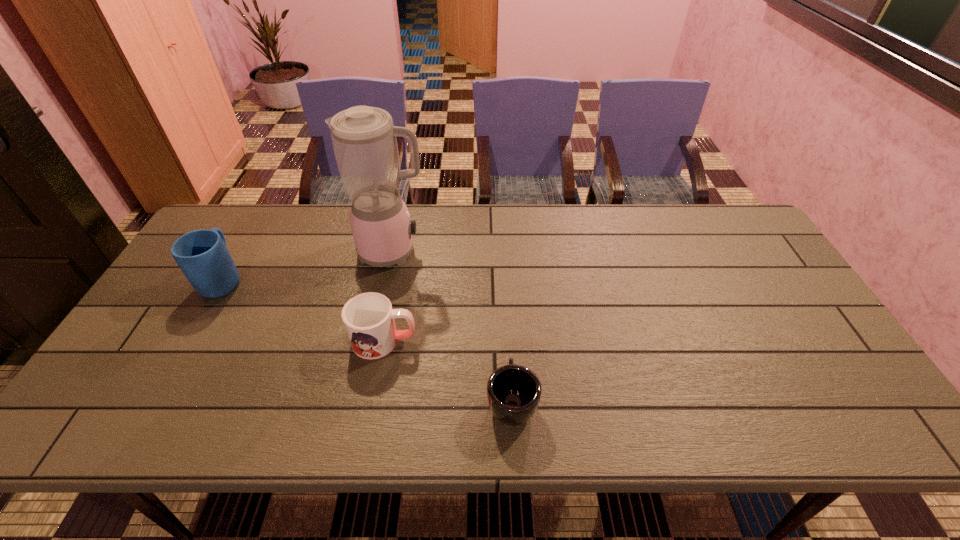
The image size is (960, 540). In order to click on vacant region located on the side of the tallest mug with the handle in this screenshot , I will do `click(244, 245)`.

This screenshot has width=960, height=540. I want to click on vacant space located 0.240m on the side of the second mug from right to left with the handle, so click(x=511, y=340).

Identify the location of free region located on the side of the shortest object with the handle. (504, 264).

Where is `blank area located on the side of the shortest object with the handle`? The height and width of the screenshot is (540, 960). blank area located on the side of the shortest object with the handle is located at coordinates (507, 320).

Identify the location of blank space located 0.360m on the side of the shortest object with the handle. (504, 268).

Image resolution: width=960 pixels, height=540 pixels. Find the location of `object that is at the far edge`. object that is at the far edge is located at coordinates (364, 141).

Where is `object that is at the near edge`? The height and width of the screenshot is (540, 960). object that is at the near edge is located at coordinates (514, 391).

Find the location of a particular element. object present at the left edge is located at coordinates (202, 255).

In the image, there is a desktop. Where is `vacant space at the far edge`? The height and width of the screenshot is (540, 960). vacant space at the far edge is located at coordinates (570, 208).

This screenshot has height=540, width=960. In order to click on vacant region at the left edge of the desktop in this screenshot , I will do click(x=148, y=362).